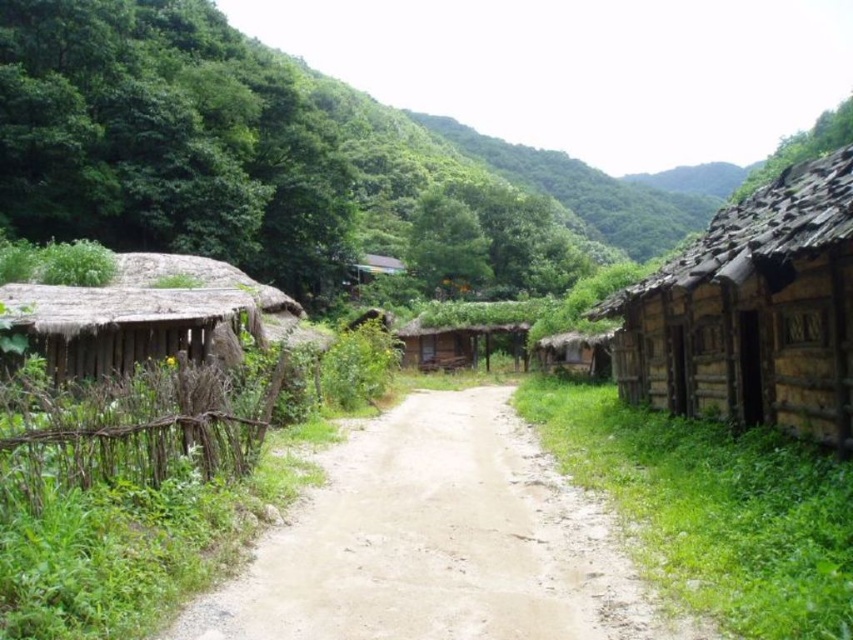
You are a traveler standing at the edge of the village, looking towards the center. You see a brown dirt track at center and a brown thatched hut at center. Which one is positioned to the left of the other?

The brown dirt track at center is to the left of the brown thatched hut at center.